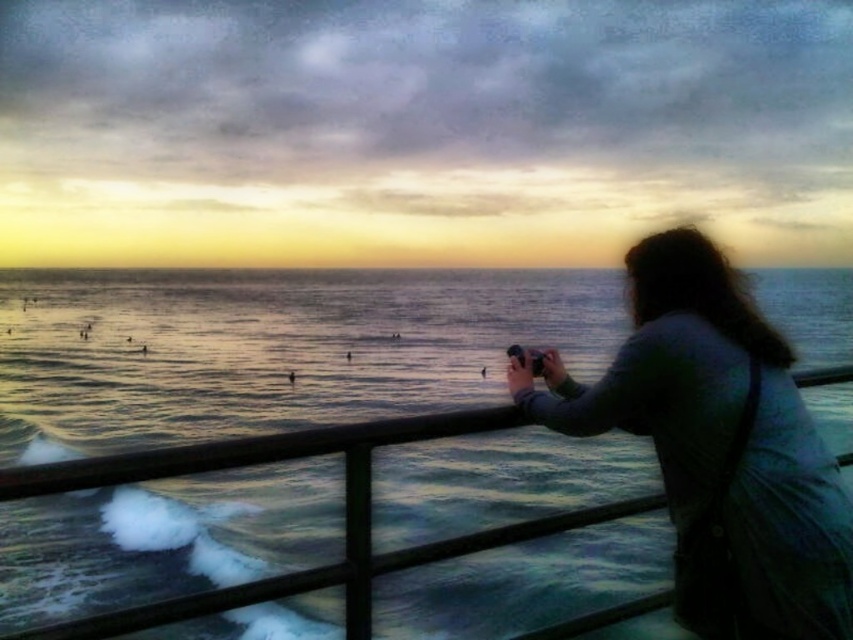
You are planning to take a photo of the blue water at center and the dark gray fabric jacket at right. Which object should you focus on first if you want to capture both in a single frame without moving the camera?

The blue water at center has a larger size compared to dark gray fabric jacket at right, so you should focus on the blue water at center first as it occupies more space in the frame.